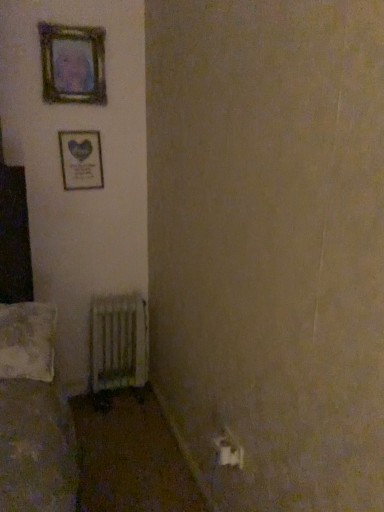
Question: Is white textured pillow at lower left not inside wooden frame at upper left, the 2th picture frame in the bottom-to-top sequence?

Choices:
 (A) yes
 (B) no

Answer: (A)

Question: From a real-world perspective, is white textured pillow at lower left under wooden frame at upper left, the first picture frame from the top?

Choices:
 (A) yes
 (B) no

Answer: (A)

Question: From the image's perspective, is white textured pillow at lower left under wooden frame at upper left, the first picture frame from the top?

Choices:
 (A) yes
 (B) no

Answer: (A)

Question: Is white textured pillow at lower left at the right side of wooden frame at upper left, the first picture frame from the top?

Choices:
 (A) yes
 (B) no

Answer: (B)

Question: Is white textured pillow at lower left positioned far away from wooden frame at upper left, the 2th picture frame in the bottom-to-top sequence?

Choices:
 (A) no
 (B) yes

Answer: (B)

Question: In terms of size, does metallic radiator at lower left appear bigger or smaller than wooden frame at upper left, the 2th picture frame in the bottom-to-top sequence?

Choices:
 (A) big
 (B) small

Answer: (A)

Question: Visually, is metallic radiator at lower left positioned to the left or to the right of wooden frame at upper left, the 2th picture frame in the bottom-to-top sequence?

Choices:
 (A) left
 (B) right

Answer: (B)

Question: From the image's perspective, relative to wooden frame at upper left, the first picture frame from the top, is metallic radiator at lower left above or below?

Choices:
 (A) above
 (B) below

Answer: (B)

Question: Is metallic radiator at lower left taller or shorter than wooden frame at upper left, the first picture frame from the top?

Choices:
 (A) short
 (B) tall

Answer: (B)

Question: Considering the positions of point (74, 32) and point (0, 370), is point (74, 32) closer or farther from the camera than point (0, 370)?

Choices:
 (A) closer
 (B) farther

Answer: (B)

Question: Is wooden frame at upper left, the 2th picture frame in the bottom-to-top sequence, inside the boundaries of white textured pillow at lower left, or outside?

Choices:
 (A) outside
 (B) inside

Answer: (A)

Question: From a real-world perspective, is wooden frame at upper left, the 2th picture frame in the bottom-to-top sequence, physically located above or below white textured pillow at lower left?

Choices:
 (A) above
 (B) below

Answer: (A)

Question: Looking at the image, does wooden frame at upper left, the first picture frame from the top, seem bigger or smaller compared to white textured pillow at lower left?

Choices:
 (A) small
 (B) big

Answer: (A)

Question: Visually, is white textured pillow at lower left positioned to the left or to the right of wooden frame at upper left, placed as the second picture frame when sorted from top to bottom?

Choices:
 (A) left
 (B) right

Answer: (A)

Question: Considering the positions of point (49, 306) and point (96, 168), is point (49, 306) closer or farther from the camera than point (96, 168)?

Choices:
 (A) farther
 (B) closer

Answer: (B)